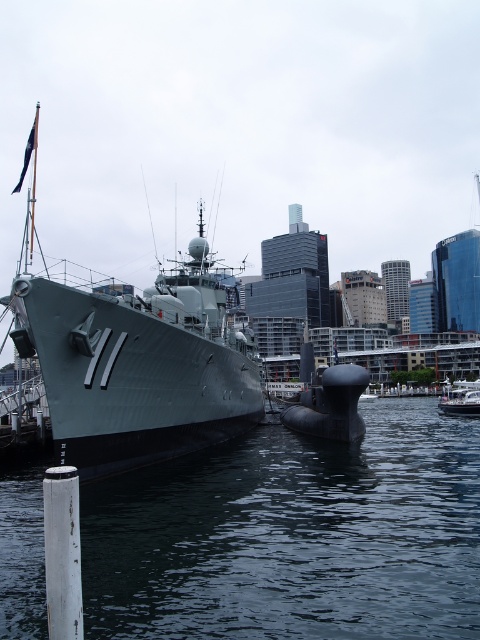
Question: In this image, where is dark blue water at lower center located relative to white glossy boat at lower right?

Choices:
 (A) below
 (B) above

Answer: (B)

Question: Which point appears farthest from the camera in this image?

Choices:
 (A) (301, 500)
 (B) (455, 392)

Answer: (B)

Question: Which object is the farthest from the white glossy boat at lower right?

Choices:
 (A) matte gray ship at center
 (B) dark blue water at lower center

Answer: (A)

Question: Among these objects, which one is farthest from the camera?

Choices:
 (A) matte gray ship at center
 (B) dark blue water at lower center

Answer: (A)

Question: Is dark blue water at lower center further to the viewer compared to white glossy boat at lower right?

Choices:
 (A) no
 (B) yes

Answer: (A)

Question: In this image, where is dark blue water at lower center located relative to white glossy boat at lower right?

Choices:
 (A) below
 (B) above

Answer: (B)